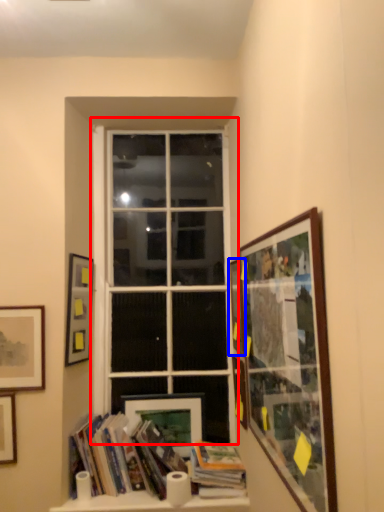
Question: Which object is further to the camera taking this photo, window (highlighted by a red box) or picture frame (highlighted by a blue box)?

Choices:
 (A) window
 (B) picture frame

Answer: (A)